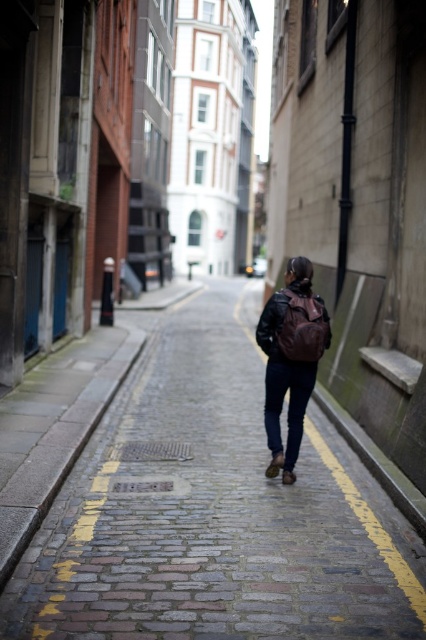
Question: Does matte brown backpack at center have a lesser width compared to leather jacket at center?

Choices:
 (A) yes
 (B) no

Answer: (B)

Question: Estimate the real-world distances between objects in this image. Which object is farther from the matte brown backpack at center?

Choices:
 (A) leather jacket at center
 (B) cobblestone pavement at center

Answer: (B)

Question: Among these objects, which one is farthest from the camera?

Choices:
 (A) leather jacket at center
 (B) cobblestone pavement at center

Answer: (A)

Question: Which point is farther to the camera?

Choices:
 (A) cobblestone pavement at center
 (B) matte brown backpack at center
 (C) leather jacket at center

Answer: (C)

Question: Can you confirm if cobblestone pavement at center is positioned to the left of matte brown backpack at center?

Choices:
 (A) yes
 (B) no

Answer: (A)

Question: Does matte brown backpack at center appear under leather jacket at center?

Choices:
 (A) yes
 (B) no

Answer: (A)